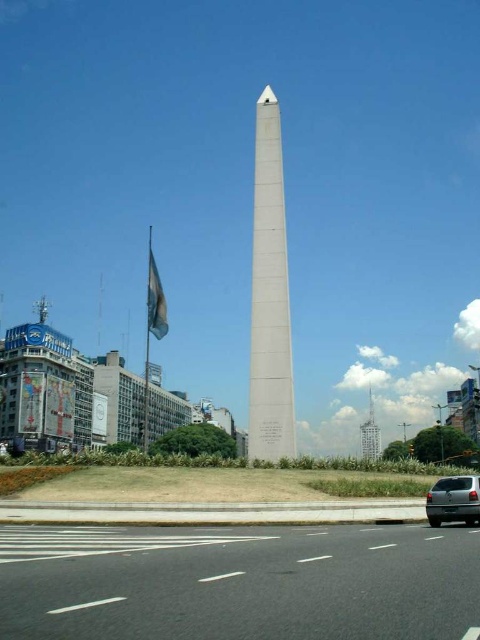
You are a pedestrian standing at the edge of the black asphalt road at lower center and want to cross to the flagpole with a flag in the background. The silver metallic van at lower right is blocking your view. Can you safely cross without stepping onto the road?

The black asphalt road at lower center is positioned over the silver metallic van at lower right, meaning the van is underneath the road. Since the van is not on the road itself but beneath it, you can safely cross the black asphalt road at lower center without obstruction from the van.

You are a pedestrian standing at the edge of the black asphalt road at lower center. You want to walk to the white polished stone obelisk at center. Which direction should you move relative to the road?

The white polished stone obelisk at center is to the left of the black asphalt road at lower center. Therefore, you should move to the left side of the road to reach the obelisk.